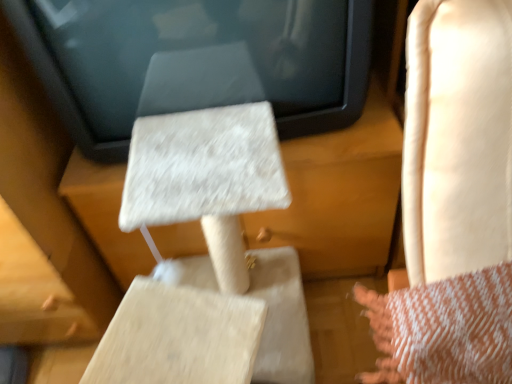
Question: Is the position of light beige leather rocking chair at right less distant than that of beige textured cat tree at center?

Choices:
 (A) yes
 (B) no

Answer: (A)

Question: Considering the relative sizes of light beige leather rocking chair at right and beige textured cat tree at center in the image provided, is light beige leather rocking chair at right shorter than beige textured cat tree at center?

Choices:
 (A) no
 (B) yes

Answer: (A)

Question: Does light beige leather rocking chair at right have a smaller size compared to beige textured cat tree at center?

Choices:
 (A) no
 (B) yes

Answer: (B)

Question: From a real-world perspective, is light beige leather rocking chair at right on beige textured cat tree at center?

Choices:
 (A) no
 (B) yes

Answer: (B)

Question: Is light beige leather rocking chair at right outside beige textured cat tree at center?

Choices:
 (A) no
 (B) yes

Answer: (B)

Question: From the image's perspective, is beige textured cat tree at center located above or below white textured cat tree at center?

Choices:
 (A) above
 (B) below

Answer: (B)

Question: Considering the positions of beige textured cat tree at center and white textured cat tree at center in the image, is beige textured cat tree at center bigger or smaller than white textured cat tree at center?

Choices:
 (A) big
 (B) small

Answer: (A)

Question: In the image, is beige textured cat tree at center positioned in front of or behind white textured cat tree at center?

Choices:
 (A) behind
 (B) front

Answer: (B)

Question: Is beige textured cat tree at center wider or thinner than white textured cat tree at center?

Choices:
 (A) wide
 (B) thin

Answer: (A)

Question: Is white textured cat tree at center inside the boundaries of beige textured cat tree at center, or outside?

Choices:
 (A) inside
 (B) outside

Answer: (B)

Question: Considering the positions of white textured cat tree at center and beige textured cat tree at center in the image, is white textured cat tree at center bigger or smaller than beige textured cat tree at center?

Choices:
 (A) small
 (B) big

Answer: (A)

Question: From a real-world perspective, relative to beige textured cat tree at center, is white textured cat tree at center vertically above or below?

Choices:
 (A) below
 (B) above

Answer: (B)

Question: Considering the positions of point (294, 54) and point (340, 377), is point (294, 54) closer or farther from the camera than point (340, 377)?

Choices:
 (A) farther
 (B) closer

Answer: (B)

Question: Looking at the image, does beige textured cat tree at center seem bigger or smaller compared to light beige leather rocking chair at right?

Choices:
 (A) small
 (B) big

Answer: (B)

Question: Considering the positions of point 294,175 and point 506,357, is point 294,175 closer or farther from the camera than point 506,357?

Choices:
 (A) closer
 (B) farther

Answer: (B)